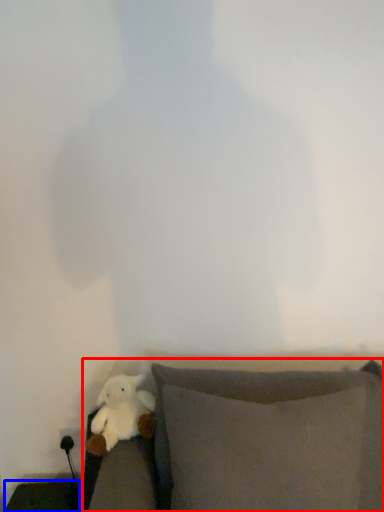
Question: Which of the following is the farthest to the observer, furniture (highlighted by a red box) or furniture (highlighted by a blue box)?

Choices:
 (A) furniture
 (B) furniture

Answer: (B)